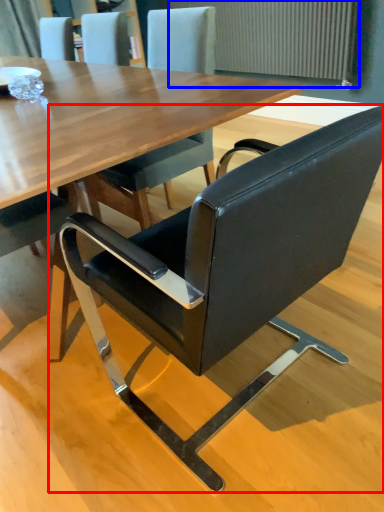
Question: Among these objects, which one is nearest to the camera, chair (highlighted by a red box) or radiator (highlighted by a blue box)?

Choices:
 (A) chair
 (B) radiator

Answer: (A)